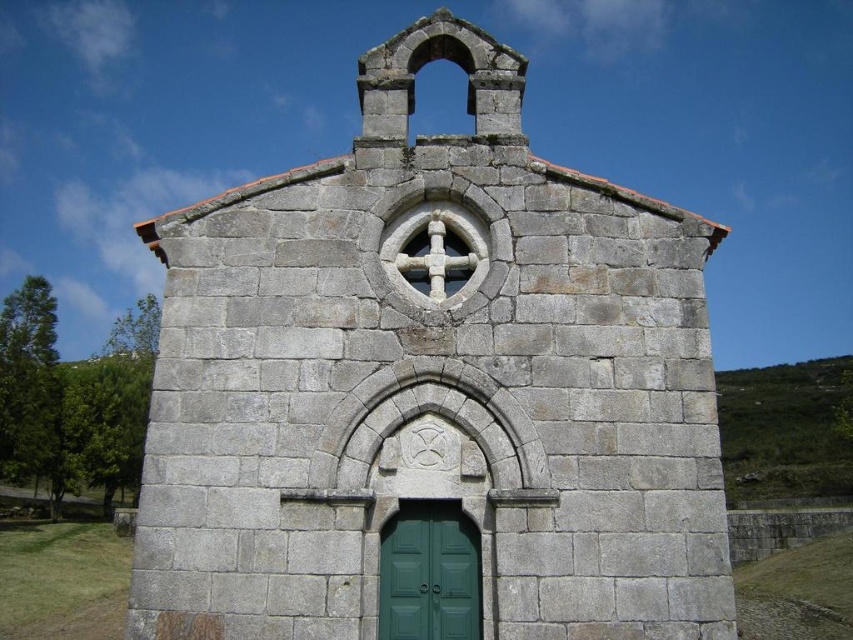
Question: Estimate the real-world distances between objects in this image. Which object is farther from the green wooden door at center?

Choices:
 (A) white stone cross at center
 (B) gray stone church at center

Answer: (A)

Question: Is the position of green wooden door at center more distant than that of white stone cross at center?

Choices:
 (A) yes
 (B) no

Answer: (B)

Question: Is green wooden door at center bigger than white stone cross at center?

Choices:
 (A) yes
 (B) no

Answer: (B)

Question: Which point is farther from the camera taking this photo?

Choices:
 (A) (440, 276)
 (B) (421, 602)

Answer: (A)

Question: Is gray stone church at center below white stone cross at center?

Choices:
 (A) yes
 (B) no

Answer: (A)

Question: Which point is farther to the camera?

Choices:
 (A) white stone cross at center
 (B) gray stone church at center

Answer: (A)